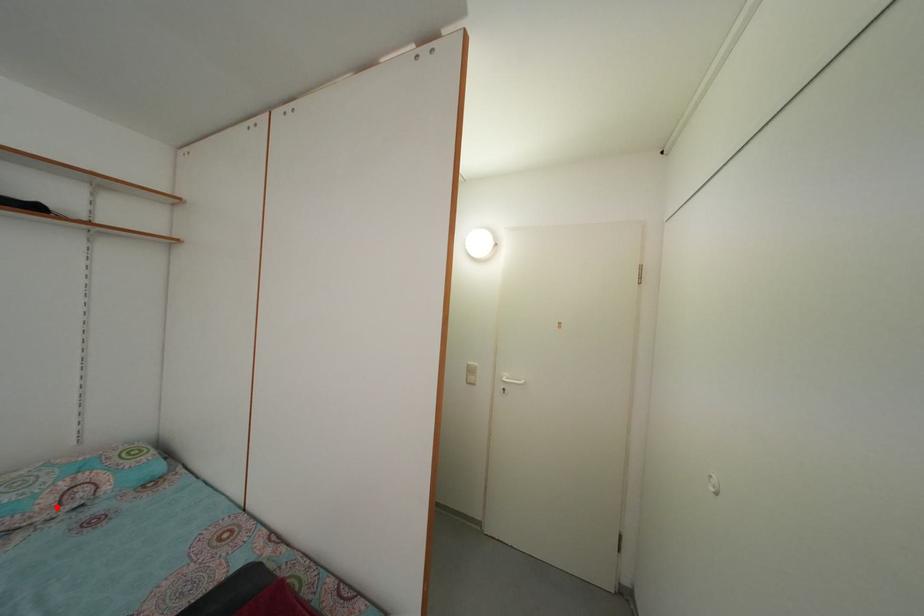
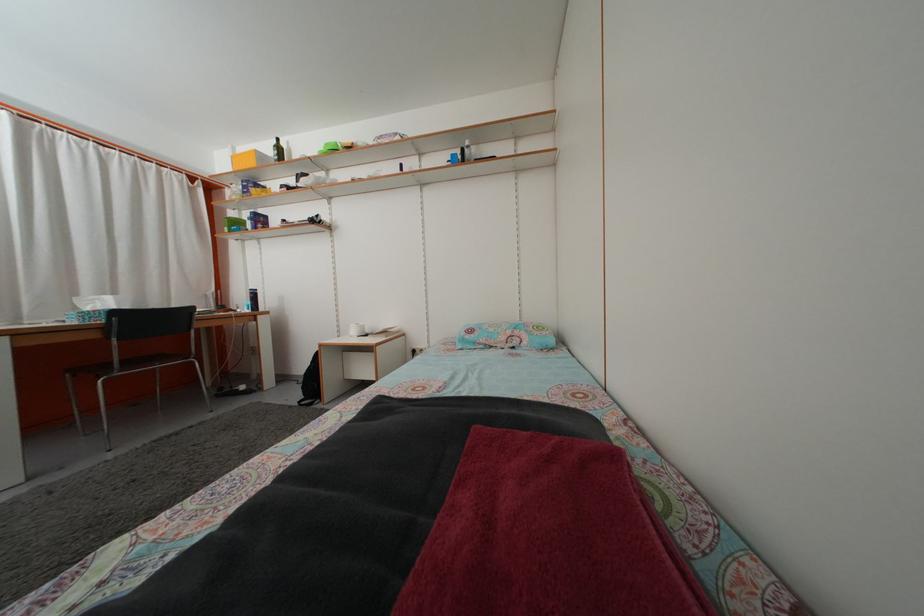
Locate, in the second image, the point that corresponds to the highlighted location in the first image.

(508, 346)